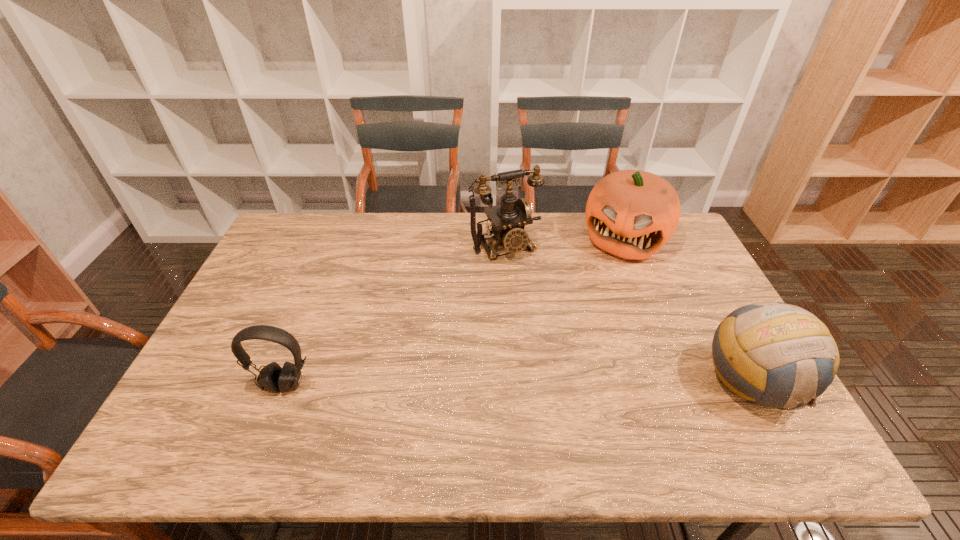
The height and width of the screenshot is (540, 960). What are the coordinates of `object at the near right corner` in the screenshot? It's located at (774, 354).

Where is `vacant space at the far edge`? This screenshot has height=540, width=960. vacant space at the far edge is located at coordinates (449, 212).

Where is `free space at the near edge`? free space at the near edge is located at coordinates (369, 394).

Where is `vacant space at the left edge of the desktop`? vacant space at the left edge of the desktop is located at coordinates (229, 379).

Identify the location of empty space that is in between the telephone and the leftmost object. The width and height of the screenshot is (960, 540). (395, 315).

The image size is (960, 540). Identify the location of vacant space that's between the pumpkin and the leftmost object. (454, 312).

Locate an element on the screen. Image resolution: width=960 pixels, height=540 pixels. vacant space that's between the volleyball and the second object from left to right is located at coordinates (629, 314).

Find the location of a particular element. Image resolution: width=960 pixels, height=540 pixels. free spot between the leftmost object and the volleyball is located at coordinates (518, 383).

Where is `unoccupied area between the pumpkin and the telephone`? unoccupied area between the pumpkin and the telephone is located at coordinates (564, 242).

Where is `free space between the second object from left to right and the volleyball`? The height and width of the screenshot is (540, 960). free space between the second object from left to right and the volleyball is located at coordinates (629, 314).